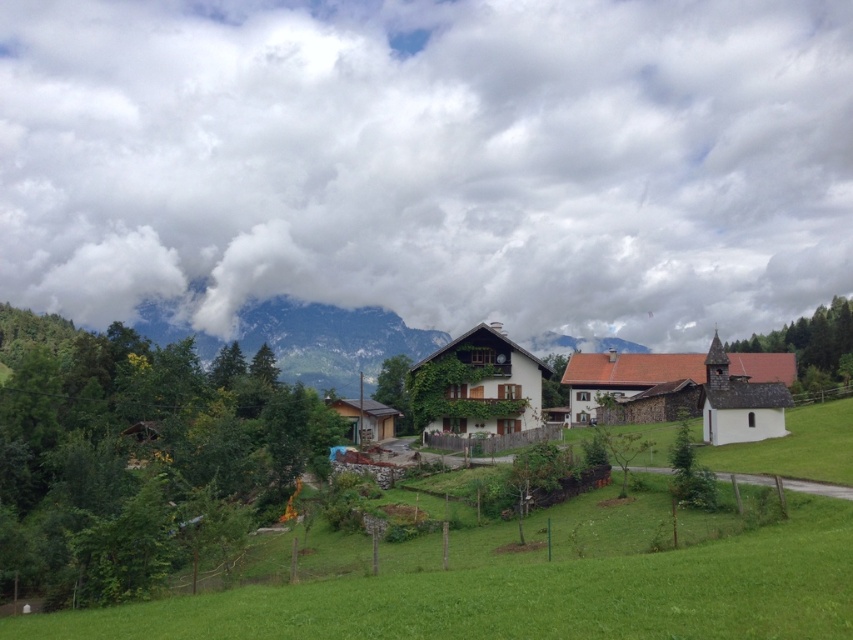
Based on the photo, you are standing in the middle of the green grassy field at center and looking towards the white fluffy cloud at upper center. Which direction should you face to see the cloud?

You should face to the left because the white fluffy cloud at upper center is located to the left of the green grassy field at center.

You are standing in the rural landscape scene and want to walk from the point closer to you to the farther point. Which path would you take between the two points, point (819, 163) and point (314, 316)?

You should walk from point (819, 163) to point (314, 316) because point (819, 163) is closer to you than point (314, 316), so the path goes from the closer point to the farther one.